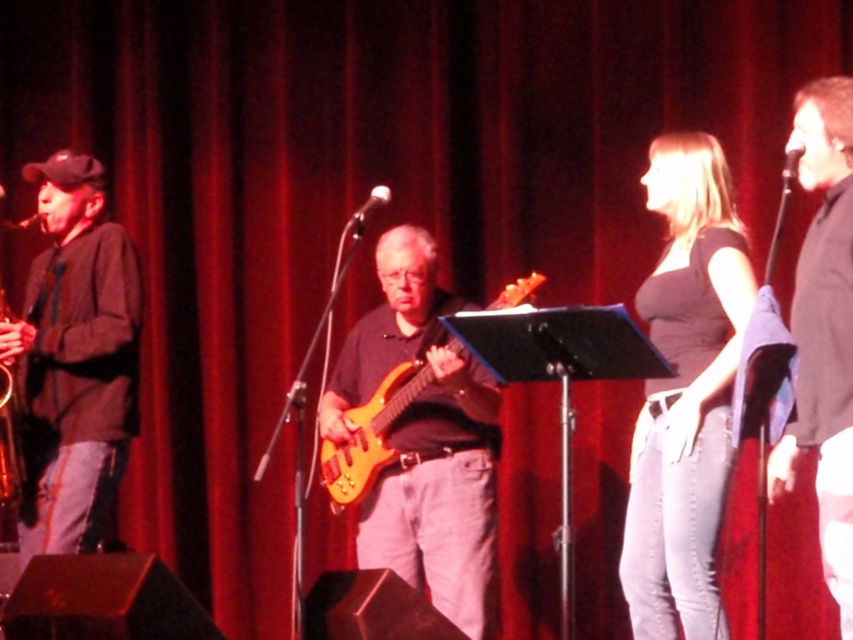
Question: Which point is farther from the camera taking this photo?

Choices:
 (A) (91, 182)
 (B) (651, 204)

Answer: (A)

Question: Can you confirm if matte black jacket at left is smaller than glossy wood guitar at center?

Choices:
 (A) no
 (B) yes

Answer: (B)

Question: Which point appears farthest from the camera in this image?

Choices:
 (A) (688, 419)
 (B) (840, 552)
 (C) (30, 467)
 (D) (520, 278)

Answer: (D)

Question: Which point is closer to the camera?

Choices:
 (A) (675, 253)
 (B) (846, 216)

Answer: (B)

Question: From the image, what is the correct spatial relationship of matte black top at center in relation to black matte shirt at center?

Choices:
 (A) left
 (B) right

Answer: (A)

Question: Is matte black top at center closer to camera compared to matte black jacket at left?

Choices:
 (A) no
 (B) yes

Answer: (B)